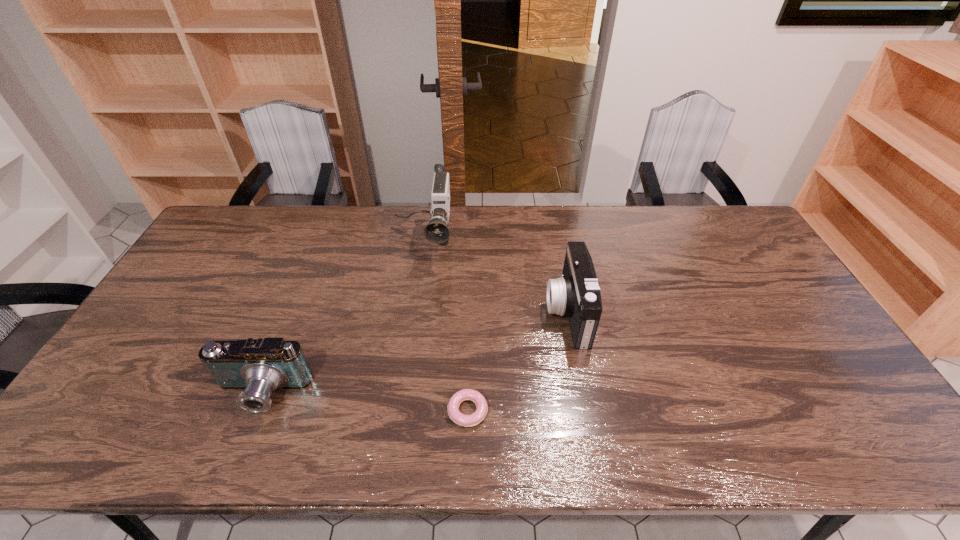
Identify which object is the third closest to the second tallest camcorder. Please provide its 2D coordinates. Your answer should be formatted as a tuple, i.e. [(x, y)], where the tuple contains the x and y coordinates of a point satisfying the conditions above.

[(260, 366)]

Select which object is the second closest to the third object from right to left. Please provide its 2D coordinates. Your answer should be formatted as a tuple, i.e. [(x, y)], where the tuple contains the x and y coordinates of a point satisfying the conditions above.

[(260, 366)]

Identify which camcorder is the nearest to the third object from left to right. Please provide its 2D coordinates. Your answer should be formatted as a tuple, i.e. [(x, y)], where the tuple contains the x and y coordinates of a point satisfying the conditions above.

[(577, 294)]

You are a GUI agent. You are given a task and a screenshot of the screen. Output one action in this format:
    pyautogui.click(x=<x>, y=<y>)
    Task: Click on the camcorder that can be found as the closest to the doughnut
    
    Given the screenshot: What is the action you would take?
    pyautogui.click(x=577, y=294)

You are a GUI agent. You are given a task and a screenshot of the screen. Output one action in this format:
    pyautogui.click(x=<x>, y=<y>)
    Task: Click on the free space that satisfies the following two spatial constraints: 1. on the recording direction of the farthest camcorder; 2. on the left side of the doughnut
    
    Given the screenshot: What is the action you would take?
    (400, 411)

Find the location of `free point that satisfies the following two spatial constraints: 1. on the recording direction of the tallest object; 2. on the right side of the second object from right to left`. free point that satisfies the following two spatial constraints: 1. on the recording direction of the tallest object; 2. on the right side of the second object from right to left is located at coordinates (400, 411).